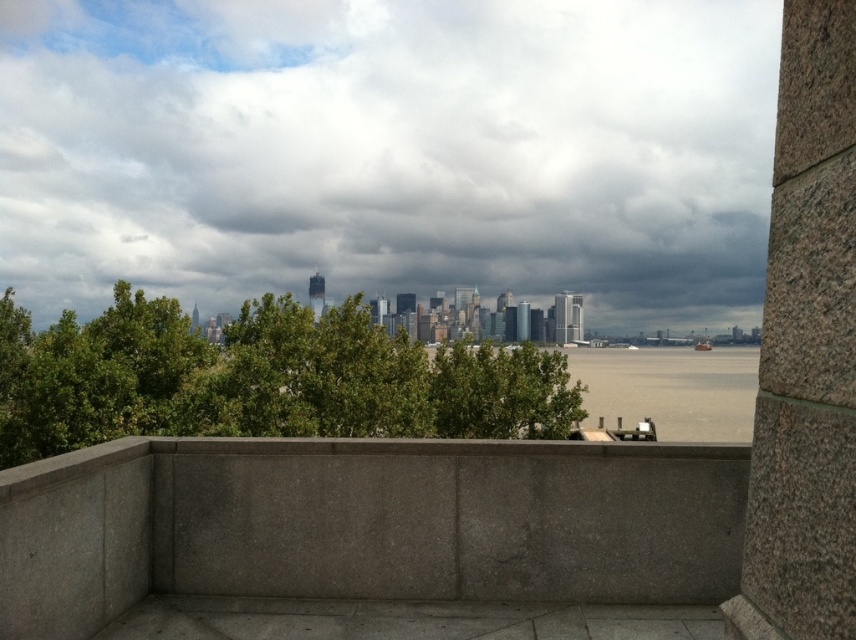
Identify the location of cloudy sky at upper center. This screenshot has width=856, height=640. (390, 150).

Is cloudy sky at upper center smaller than gray water at lower center?

Incorrect, cloudy sky at upper center is not smaller in size than gray water at lower center.

Where is `cloudy sky at upper center`? This screenshot has width=856, height=640. cloudy sky at upper center is located at coordinates point(390,150).

Is gray concrete ledge at center closer to the viewer compared to gray water at lower center?

That is True.

Measure the distance from gray concrete ledge at center to gray water at lower center.

400.64 feet

Does point (132, 509) come closer to viewer compared to point (755, 385)?

That is True.

Where is `gray concrete ledge at center`? This screenshot has width=856, height=640. gray concrete ledge at center is located at coordinates (372, 540).

Is cloudy sky at upper center above gray concrete ledge at center?

Yes, cloudy sky at upper center is above gray concrete ledge at center.

Identify the location of cloudy sky at upper center. (390, 150).